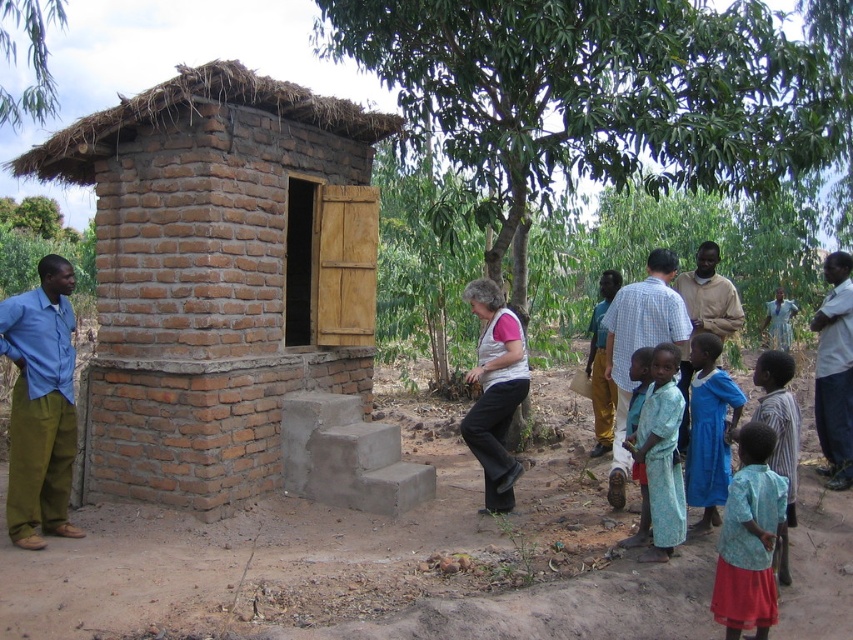
You are standing in front of the small brick structure with a thatched roof. There is a blue cotton shirt at left. Where exactly is the blue cotton shirt located in relation to the structure?

The blue cotton shirt at left is located at point (39, 404) relative to the structure.

You are a photographer trying to capture a group photo of the people in front of the brick structure. You notice two shirts in the crowd, a white matte shirt at center and a beige cotton shirt at center. Which shirt should you adjust to ensure both shirts are fully visible in the frame?

The white matte shirt at center has a smaller width than the beige cotton shirt at center. To ensure both are fully visible, adjust the white matte shirt at center to avoid overlapping with the wider beige cotton shirt at center.

From the picture: You are planning to buy a new outfit and want to match the size of the clothing items in the scene. Which clothing item, the blue cotton shirt at left or the blue cotton dress at lower right, has a larger width?

The blue cotton shirt at left has a larger width than the blue cotton dress at lower right according to the description.